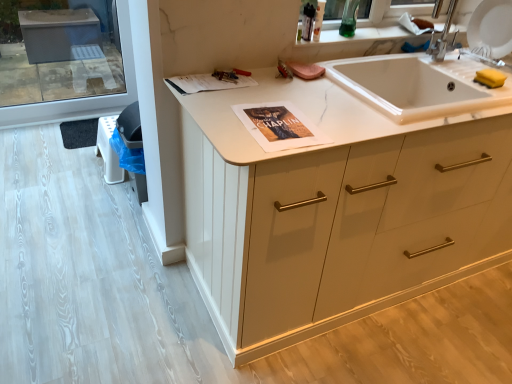
Locate an element on the screen. white matte cabinet at center is located at coordinates (334, 211).

The width and height of the screenshot is (512, 384). What do you see at coordinates (334, 211) in the screenshot?
I see `white matte cabinet at center` at bounding box center [334, 211].

Where is `white marble sink at center`? white marble sink at center is located at coordinates (301, 111).

What do you see at coordinates (210, 82) in the screenshot?
I see `matte paper magazine at upper center` at bounding box center [210, 82].

This screenshot has height=384, width=512. Identify the location of white matte cabinet at center. (334, 211).

Is white matte cabinet at center thinner than white marble sink at center?

No, white matte cabinet at center is not thinner than white marble sink at center.

Are white matte cabinet at center and white marble sink at center making contact?

white matte cabinet at center and white marble sink at center are not in contact.

Is the position of white matte cabinet at center more distant than that of white marble sink at center?

No, it is in front of white marble sink at center.

Between white matte cabinet at center and white marble sink at center, which one has smaller size?

Smaller between the two is white marble sink at center.

How many degrees apart are the facing directions of white marble sink at center and matte paper magazine at upper center?

They differ by 6.05 degrees in their facing directions.

Which object is positioned more to the right, white marble sink at center or matte paper magazine at upper center?

white marble sink at center is more to the right.

Are white marble sink at center and matte paper magazine at upper center far apart?

white marble sink at center is actually quite close to matte paper magazine at upper center.

Is white marble sink at center wider than matte paper magazine at upper center?

Indeed, white marble sink at center has a greater width compared to matte paper magazine at upper center.

Between matte paper magazine at upper center and white marble sink at center, which one appears on the left side from the viewer's perspective?

matte paper magazine at upper center is more to the left.

Where is `magazine above the white marble sink at center (from the image's perspective)`? This screenshot has width=512, height=384. magazine above the white marble sink at center (from the image's perspective) is located at coordinates point(210,82).

From the picture: Is matte paper magazine at upper center far from white marble sink at center?

No, matte paper magazine at upper center is not far away from white marble sink at center.

In the scene shown: Which is more to the left, white marble sink at center or white matte cabinet at center?

white marble sink at center.

Is white marble sink at center placed right next to white matte cabinet at center?

No, white marble sink at center is not touching white matte cabinet at center.

Which is in front, point (246, 160) or point (193, 225)?

Point (246, 160)

Is white marble sink at center oriented towards white matte cabinet at center?

Yes, white marble sink at center is facing white matte cabinet at center.

How many degrees apart are the facing directions of white matte cabinet at center and matte paper magazine at upper center?

They differ by 6.05 degrees in their facing directions.

From the image's perspective, is white matte cabinet at center beneath matte paper magazine at upper center?

Correct, white matte cabinet at center appears lower than matte paper magazine at upper center in the image.

From the picture: Is white matte cabinet at center to the left or to the right of matte paper magazine at upper center in the image?

Based on their positions, white matte cabinet at center is located to the right of matte paper magazine at upper center.

From a real-world perspective, is white matte cabinet at center over matte paper magazine at upper center?

No, from a real-world perspective, white matte cabinet at center is not on top of matte paper magazine at upper center.

This screenshot has width=512, height=384. I want to click on cabinetry below the matte paper magazine at upper center (from the image's perspective), so click(334, 211).

Considering the relative positions of matte paper magazine at upper center and white matte cabinet at center in the image provided, is matte paper magazine at upper center to the left or to the right of white matte cabinet at center?

Based on their positions, matte paper magazine at upper center is located to the left of white matte cabinet at center.

From the picture: Who is more distant, matte paper magazine at upper center or white matte cabinet at center?

matte paper magazine at upper center.

Based on the photo, who is shorter, matte paper magazine at upper center or white matte cabinet at center?

With less height is matte paper magazine at upper center.

At what (x,y) coordinates should I click in order to perform the action: click on cabinetry in front of the white marble sink at center. Please return your answer as a coordinate pair (x, y). Looking at the image, I should click on (334, 211).

In the image, there is a white marble sink at center. Where is `magazine above it (from the image's perspective)`? magazine above it (from the image's perspective) is located at coordinates (210, 82).

Estimate the real-world distances between objects in this image. Which object is closer to white marble sink at center, white matte cabinet at center or matte paper magazine at upper center?

matte paper magazine at upper center lies closer to white marble sink at center than the other object.

From the image, which object appears to be farther from white matte cabinet at center, white marble sink at center or matte paper magazine at upper center?

matte paper magazine at upper center is positioned further to the anchor white matte cabinet at center.

When comparing their distances from white marble sink at center, does matte paper magazine at upper center or white matte cabinet at center seem closer?

Among the two, matte paper magazine at upper center is located nearer to white marble sink at center.

Considering their positions, is white matte cabinet at center positioned further to matte paper magazine at upper center than white marble sink at center?

Among the two, white matte cabinet at center is located further to matte paper magazine at upper center.

Looking at the image, which one is located closer to matte paper magazine at upper center, white marble sink at center or white matte cabinet at center?

Among the two, white marble sink at center is located nearer to matte paper magazine at upper center.

From the image, which object appears to be farther from white matte cabinet at center, matte paper magazine at upper center or white marble sink at center?

The object further to white matte cabinet at center is matte paper magazine at upper center.

At what (x,y) coordinates should I click in order to perform the action: click on countertop between matte paper magazine at upper center and white matte cabinet at center from left to right. Please return your answer as a coordinate pair (x, y). Looking at the image, I should click on (301, 111).